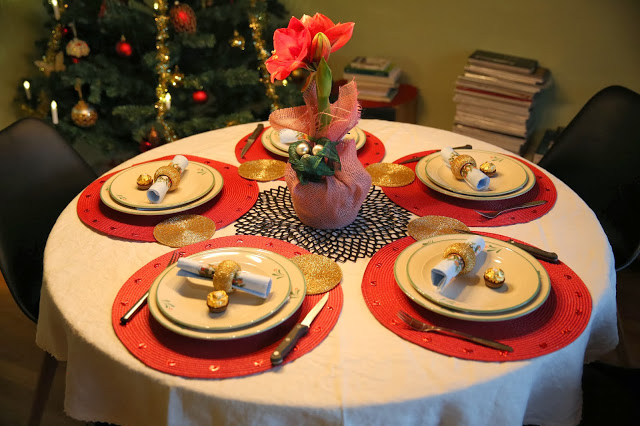
The image size is (640, 426). I want to click on round red placemats, so click(233, 359), click(384, 303), click(239, 198), click(412, 188), click(372, 149).